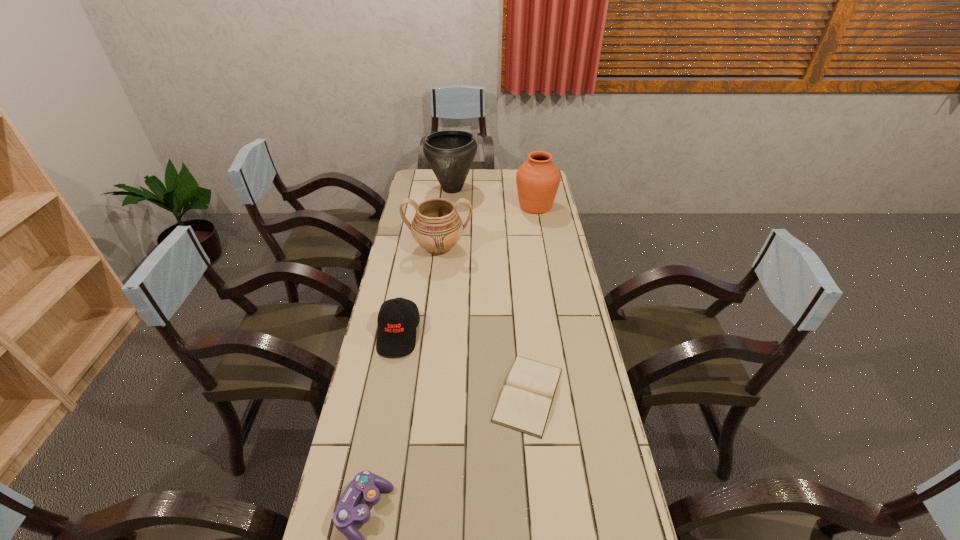
This screenshot has width=960, height=540. I want to click on the rightmost urn, so click(x=538, y=178).

Where is `the nearest urn`? The height and width of the screenshot is (540, 960). the nearest urn is located at coordinates (437, 227).

Where is `the fourth tallest object`? the fourth tallest object is located at coordinates (398, 318).

You are a GUI agent. You are given a task and a screenshot of the screen. Output one action in this format:
    pyautogui.click(x=<x>, y=<y>)
    Task: Click on the shortest object
    
    Given the screenshot: What is the action you would take?
    pyautogui.click(x=524, y=405)

Locate an element on the screen. This screenshot has width=960, height=540. free space located on the left of the rightmost urn is located at coordinates (464, 206).

Where is `free location located on the front-facing side of the nearest urn`? The width and height of the screenshot is (960, 540). free location located on the front-facing side of the nearest urn is located at coordinates (434, 288).

Locate an element on the screen. This screenshot has width=960, height=540. vacant space located 0.350m on the front-facing side of the baseball cap is located at coordinates (374, 464).

The image size is (960, 540). I want to click on free space located on the front of the shortest object, so click(x=538, y=494).

Image resolution: width=960 pixels, height=540 pixels. Find the location of `object that is at the far edge`. object that is at the far edge is located at coordinates (450, 153).

The image size is (960, 540). In order to click on baseball cap that is at the left edge in this screenshot , I will do `click(398, 318)`.